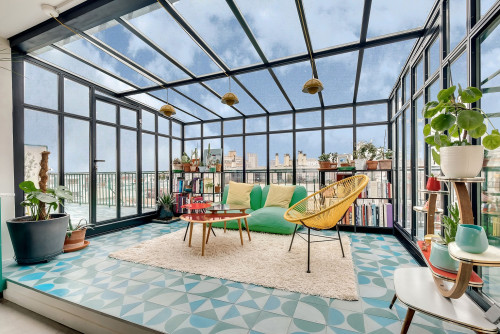
Where is `rug`? Image resolution: width=500 pixels, height=334 pixels. rug is located at coordinates pyautogui.click(x=269, y=253).